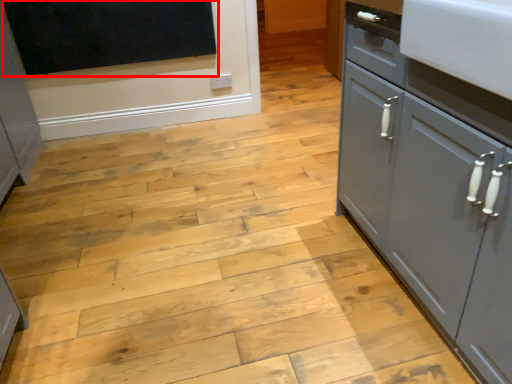
Question: From the image, what is the correct spatial relationship of dark (annotated by the red box) in relation to cupboard?

Choices:
 (A) right
 (B) left

Answer: (B)